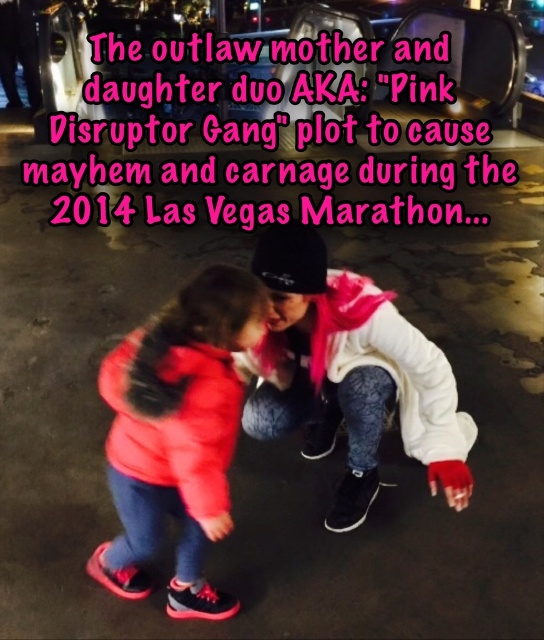
In the scene shown: You are standing in front of the scene and want to pick up an object located at point [404,438] and another object at point [215,396]. Which point is closer to you?

Point [404,438] is closer to you because it is further to the viewer than point [215,396].

You are a photographer trying to capture a candid shot of both the white matte jacket at center and the matte red jacket at lower left. Since you can only focus on one subject at a time, which jacket should you focus on to ensure the other remains in the background?

You should focus on the white matte jacket at center because the matte red jacket at lower left is behind it, so focusing on the front subject will keep the background subject in focus as well.

You are a photographer trying to capture a candid shot of both the white matte jacket at center and the matte red jacket at lower left in the scene. Since you want to ensure both are visible, which jacket should you focus on to frame the shot properly?

The white matte jacket at center occupies less space than the matte red jacket at lower left. Therefore, to frame both properly, focus on the matte red jacket at lower left as it is larger and will help anchor the shot while ensuring the smaller white matte jacket at center remains visible.